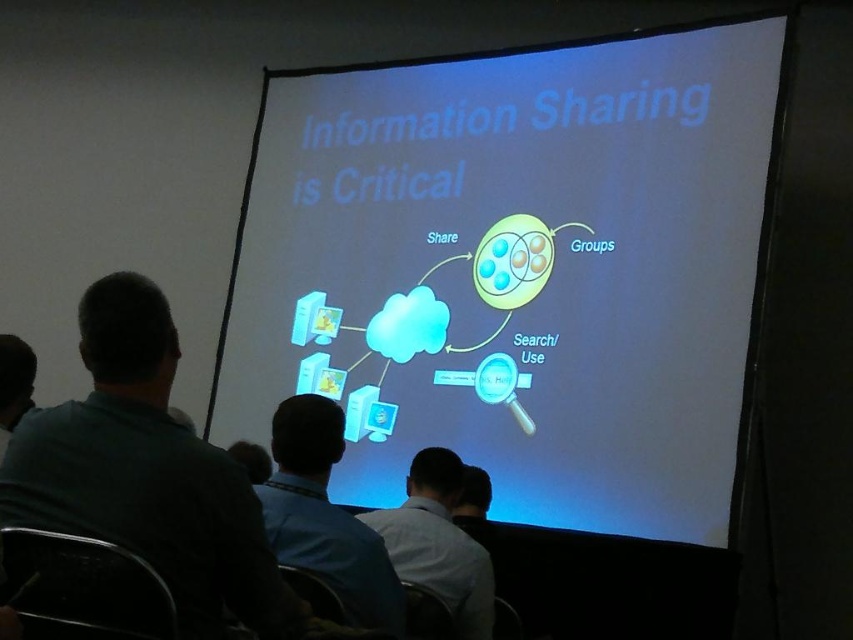
Consider the image. Based on the scene description, which shirt is positioned to the left of the other? The blue shirt at center or the gray shirt at lower center?

The blue shirt at center is to the left of the gray shirt at lower center.

Based on the scene description, which object is bigger between the white glossy projector screen at center and the gray shirt at lower center?

The white glossy projector screen at center is larger in size compared to the gray shirt at lower center.